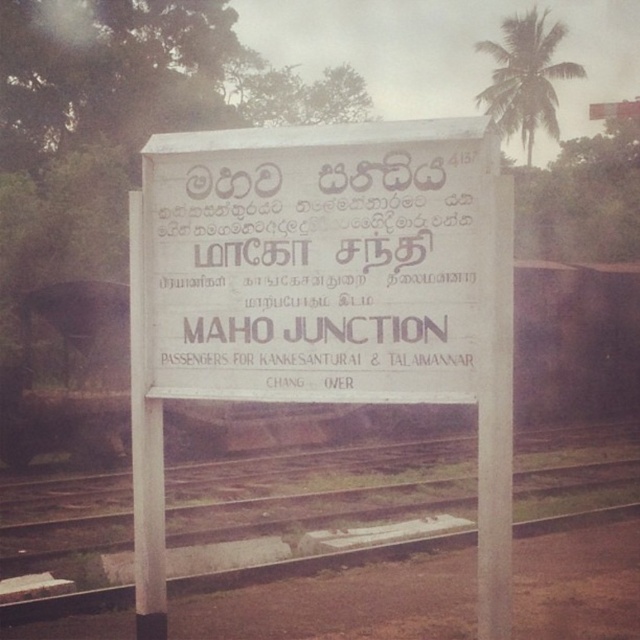
Between white matte sign at center and brown wooden train track at center, which one appears on the right side from the viewer's perspective?

brown wooden train track at center

Is point (186, 328) positioned behind point (618, 433)?

No, it is not.

Who is more distant from viewer, (212, 333) or (109, 528)?

The point (109, 528) is more distant.

Locate an element on the screen. The image size is (640, 640). white matte sign at center is located at coordinates (323, 298).

Who is shorter, white matte sign at center or white paper sign at center?

white paper sign at center is shorter.

Is white matte sign at center wider than white paper sign at center?

Indeed, white matte sign at center has a greater width compared to white paper sign at center.

The height and width of the screenshot is (640, 640). Describe the element at coordinates (323, 298) in the screenshot. I see `white matte sign at center` at that location.

You are a GUI agent. You are given a task and a screenshot of the screen. Output one action in this format:
    pyautogui.click(x=<x>, y=<y>)
    Task: Click on the white matte sign at center
    The width and height of the screenshot is (640, 640).
    Given the screenshot: What is the action you would take?
    pyautogui.click(x=323, y=298)

Who is lower down, white paper sign at center or brown wooden train track at center?

brown wooden train track at center

Is point (356, 170) closer to camera compared to point (374, 486)?

Yes, point (356, 170) is in front of point (374, 486).

Measure the distance between white paper sign at center and camera.

They are 15.10 feet apart.

I want to click on white paper sign at center, so click(x=314, y=273).